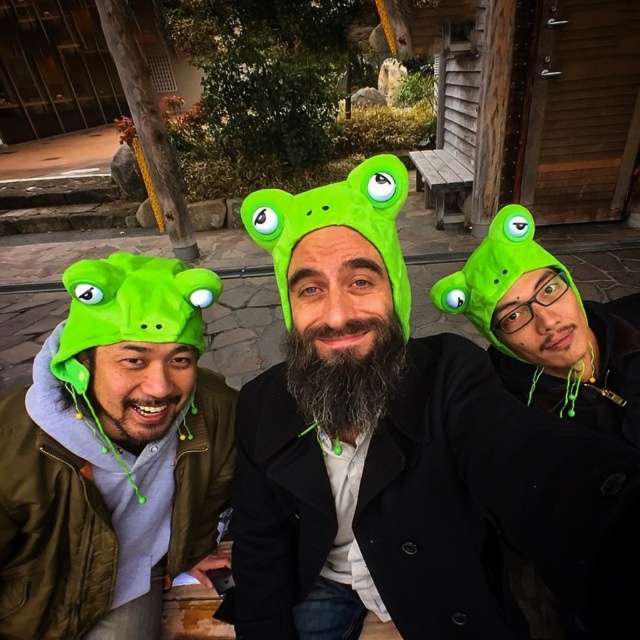
You are a photographer standing at a distance of 15 inches from the green matte frog hat at center. Can you take a clear photo of it without moving closer?

The green matte frog hat at center is 14.59 inches away from the camera, so you can take a clear photo without moving closer since it is within the 15 inches distance.

You are standing in front of the three people in the image. You want to point to the exact location of the point at coordinates (404, 454). Which object in the scene should you point to?

The point at coordinates (404, 454) is located on the green matte frog hat at center, so you should point to the green matte frog hat at center.

You are a photographer trying to capture a group photo of the three people in the scene. You want to ensure that the green matte frog hat at center and the green matte frog hat at left are both visible in the frame. Based on their positions, which hat is lower in the image?

The green matte frog hat at center is below the green matte frog hat at left, so the green matte frog hat at center is lower in the image.